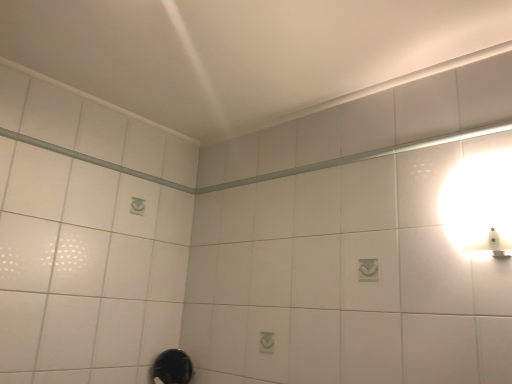
The image size is (512, 384). What do you see at coordinates (172, 368) in the screenshot?
I see `black rubber shower at lower center` at bounding box center [172, 368].

Image resolution: width=512 pixels, height=384 pixels. I want to click on black rubber shower at lower center, so click(x=172, y=368).

In order to face white glossy wall sconce at upper right, should I rotate leftwards or rightwards?

A 30.019 degree turn to the right will do.

Measure the distance between point (487, 191) and camera.

They are 3.69 feet apart.

Where is `white glossy wall sconce at upper right`? white glossy wall sconce at upper right is located at coordinates (479, 204).

The height and width of the screenshot is (384, 512). Describe the element at coordinates (479, 204) in the screenshot. I see `white glossy wall sconce at upper right` at that location.

Identify the location of black rubber shower at lower center. (172, 368).

Which is more to the left, black rubber shower at lower center or white glossy wall sconce at upper right?

From the viewer's perspective, black rubber shower at lower center appears more on the left side.

Between black rubber shower at lower center and white glossy wall sconce at upper right, which one is positioned in front?

white glossy wall sconce at upper right is closer to the camera.

Does point (172, 367) lie in front of point (461, 163)?

No, it is behind (461, 163).

Looking at this image, from the image's perspective, does black rubber shower at lower center appear higher than white glossy wall sconce at upper right?

No, from the image's perspective, black rubber shower at lower center is not over white glossy wall sconce at upper right.

From a real-world perspective, is black rubber shower at lower center over white glossy wall sconce at upper right?

Actually, black rubber shower at lower center is physically below white glossy wall sconce at upper right in the real world.

Considering the relative sizes of black rubber shower at lower center and white glossy wall sconce at upper right in the image provided, is black rubber shower at lower center thinner than white glossy wall sconce at upper right?

In fact, black rubber shower at lower center might be wider than white glossy wall sconce at upper right.

Considering the sizes of objects black rubber shower at lower center and white glossy wall sconce at upper right in the image provided, who is shorter, black rubber shower at lower center or white glossy wall sconce at upper right?

Standing shorter between the two is white glossy wall sconce at upper right.

Who is smaller, black rubber shower at lower center or white glossy wall sconce at upper right?

white glossy wall sconce at upper right.

Is black rubber shower at lower center positioned beyond the bounds of white glossy wall sconce at upper right?

Yes, black rubber shower at lower center is located beyond the bounds of white glossy wall sconce at upper right.

Is black rubber shower at lower center far from white glossy wall sconce at upper right?

Yes, black rubber shower at lower center and white glossy wall sconce at upper right are located far from each other.

Is black rubber shower at lower center aimed at white glossy wall sconce at upper right?

No, black rubber shower at lower center is not oriented towards white glossy wall sconce at upper right.

Looking at this image, what's the angular difference between black rubber shower at lower center and white glossy wall sconce at upper right's facing directions?

The angle between the facing direction of black rubber shower at lower center and the facing direction of white glossy wall sconce at upper right is 0.271 degrees.

Image resolution: width=512 pixels, height=384 pixels. Identify the location of light fixture located in front of the black rubber shower at lower center. (479, 204).

Which is more to the right, white glossy wall sconce at upper right or black rubber shower at lower center?

Positioned to the right is white glossy wall sconce at upper right.

Is white glossy wall sconce at upper right positioned behind black rubber shower at lower center?

No, white glossy wall sconce at upper right is in front of black rubber shower at lower center.

Does point (492, 204) lie in front of point (167, 354)?

Yes, point (492, 204) is closer to viewer.

In the scene shown: From the image's perspective, is white glossy wall sconce at upper right located above black rubber shower at lower center?

Yes, from the image's perspective, white glossy wall sconce at upper right is over black rubber shower at lower center.

From a real-world perspective, is white glossy wall sconce at upper right over black rubber shower at lower center?

Yes, from a real-world perspective, white glossy wall sconce at upper right is over black rubber shower at lower center

Can you confirm if white glossy wall sconce at upper right is wider than black rubber shower at lower center?

Incorrect, the width of white glossy wall sconce at upper right does not surpass that of black rubber shower at lower center.

Who is shorter, white glossy wall sconce at upper right or black rubber shower at lower center?

With less height is white glossy wall sconce at upper right.

Based on the photo, considering the relative sizes of white glossy wall sconce at upper right and black rubber shower at lower center in the image provided, is white glossy wall sconce at upper right bigger than black rubber shower at lower center?

No.

Is black rubber shower at lower center inside white glossy wall sconce at upper right?

Definitely not — black rubber shower at lower center is not inside white glossy wall sconce at upper right.

Is white glossy wall sconce at upper right touching black rubber shower at lower center?

white glossy wall sconce at upper right and black rubber shower at lower center are not in contact.

Is white glossy wall sconce at upper right looking in the opposite direction of black rubber shower at lower center?

That's not correct — white glossy wall sconce at upper right is not looking away from black rubber shower at lower center.

How much distance is there between white glossy wall sconce at upper right and black rubber shower at lower center?

white glossy wall sconce at upper right and black rubber shower at lower center are 4.04 feet apart.

What are the coordinates of `light fixture that is above the black rubber shower at lower center (from the image's perspective)` in the screenshot? It's located at pos(479,204).

I want to click on shower located below the white glossy wall sconce at upper right (from the image's perspective), so click(172, 368).

In the image, there is a black rubber shower at lower center. Identify the location of light fixture above it (from the image's perspective). (479, 204).